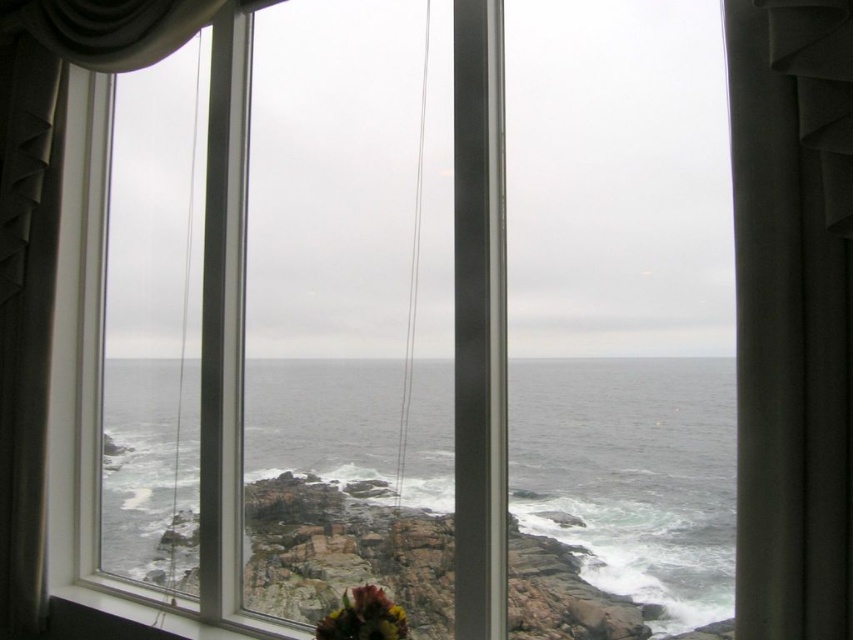
Question: Among these objects, which one is nearest to the camera?

Choices:
 (A) multicolored fabric flower at bottom center
 (B) gray matte water at center
 (C) satin fabric curtain at left

Answer: (B)

Question: Can you confirm if gray matte water at center is positioned below multicolored fabric flower at bottom center?

Choices:
 (A) yes
 (B) no

Answer: (B)

Question: Which is farther from the satin fabric curtain at left?

Choices:
 (A) multicolored fabric flower at bottom center
 (B) gray matte water at center

Answer: (A)

Question: Can you confirm if gray matte water at center is wider than multicolored fabric flower at bottom center?

Choices:
 (A) yes
 (B) no

Answer: (A)

Question: Can you confirm if gray matte water at center is positioned above multicolored fabric flower at bottom center?

Choices:
 (A) yes
 (B) no

Answer: (A)

Question: Which point is farther from the camera taking this photo?

Choices:
 (A) (399, 618)
 (B) (10, 621)

Answer: (B)